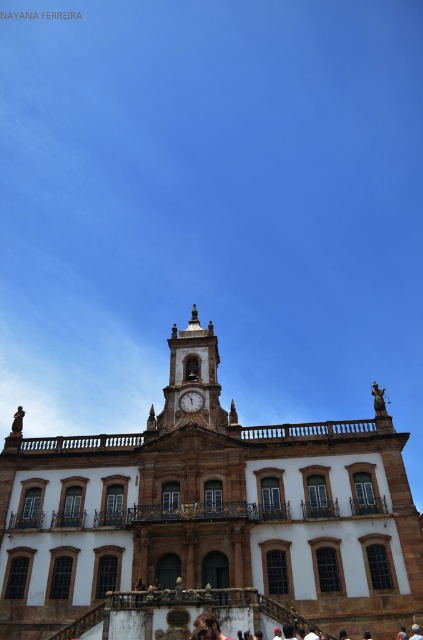
You are standing at the entrance of the building and want to locate the brown stone church at center. According to the coordinates provided, where should you look relative to your current position?

The brown stone church at center is located at coordinates point (208, 520), which means it is positioned slightly to the right and center of your current position.

You are a photographer planning to capture the entire structure of the brown stone church at center and the gold ornate clock tower at center in a single frame. Based on their widths, which one might require you to adjust your camera angle to avoid cropping?

The brown stone church at center might be wider than the gold ornate clock tower at center, so adjusting the camera angle could help capture its full width without cropping.